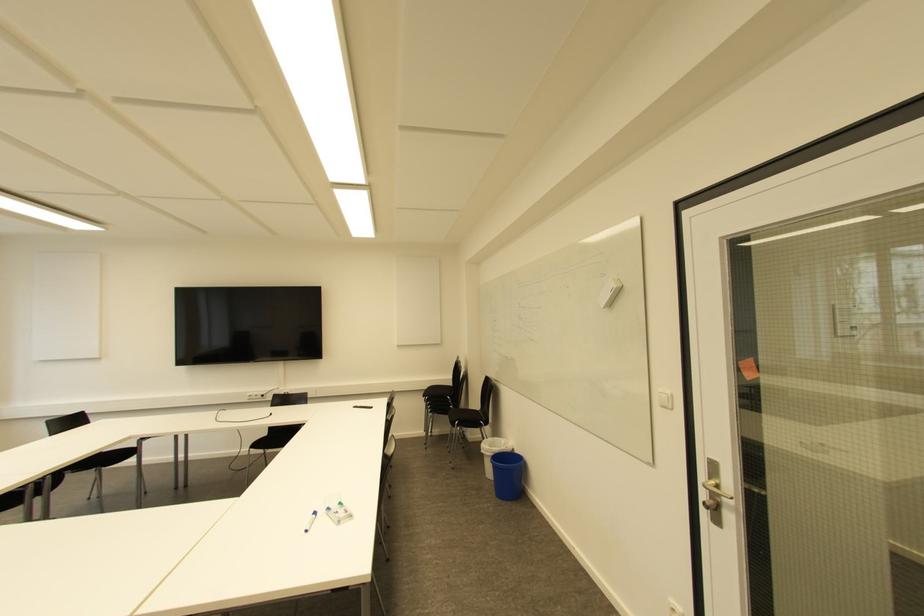
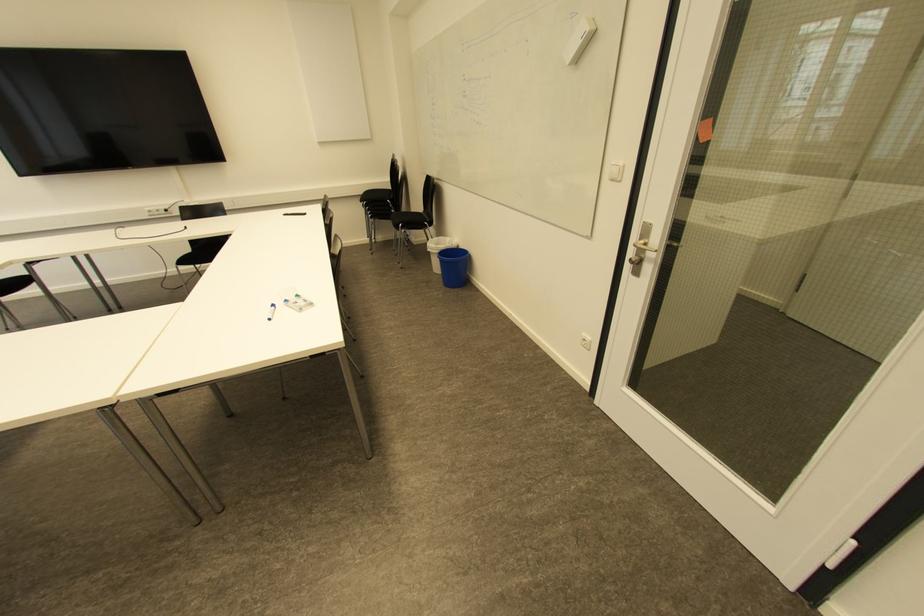
Locate, in the second image, the point that corresponds to the point at 313,514 in the first image.

(273, 306)